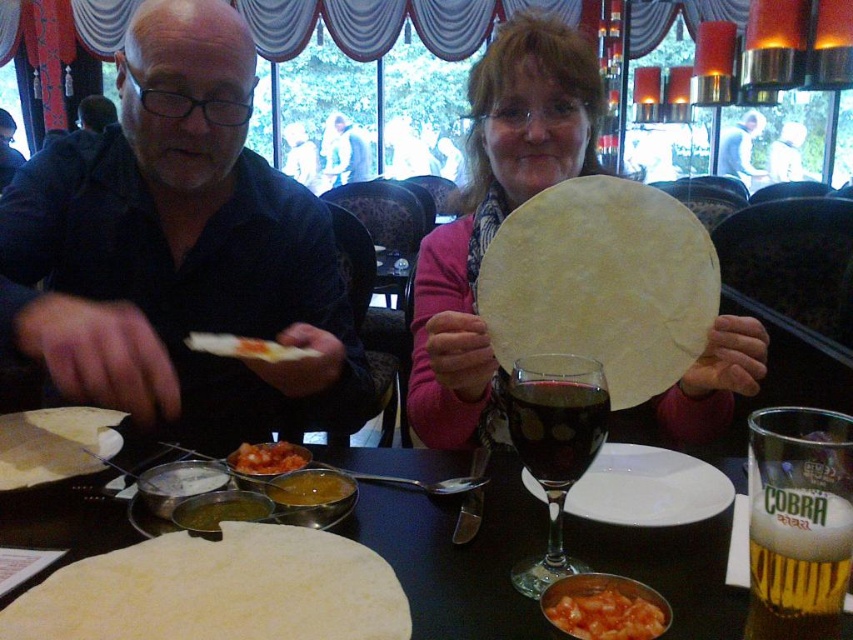
Question: Can you confirm if yellow creamy sauce at center is positioned to the left of white soft bread at center?

Choices:
 (A) no
 (B) yes

Answer: (A)

Question: Which object is closer to the camera taking this photo?

Choices:
 (A) yellow creamy sauce at center
 (B) white matte tortilla at center
 (C) white soft bread at center
 (D) dark glass wine at center

Answer: (B)

Question: Which point appears closest to the camera in this image?

Choices:
 (A) (703, 596)
 (B) (751, 630)

Answer: (B)

Question: Does matte pink sweater at center appear over tomato sauce at center?

Choices:
 (A) yes
 (B) no

Answer: (A)

Question: Is transparent glass wine glass at center smaller than green smoothie at center?

Choices:
 (A) no
 (B) yes

Answer: (A)

Question: Which of the following is the farthest from the observer?

Choices:
 (A) yellow creamy sauce at center
 (B) tomato-based sauce at lower center

Answer: (A)